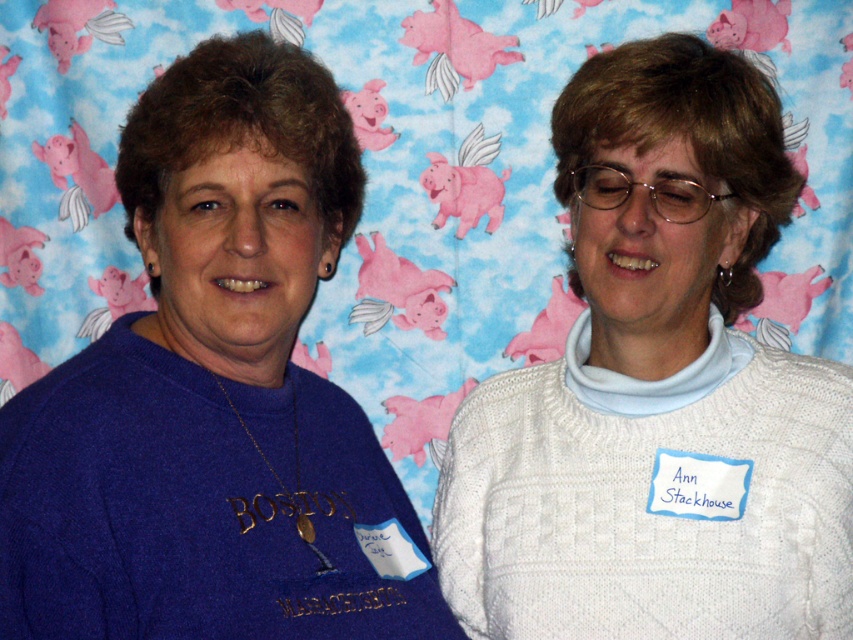
Does white knitted sweater at center have a greater height compared to matte blue sweater at left?

Indeed, white knitted sweater at center has a greater height compared to matte blue sweater at left.

Does point (495, 488) come closer to viewer compared to point (242, 365)?

No, (495, 488) is behind (242, 365).

In order to click on white knitted sweater at center in this screenshot , I will do `click(657, 388)`.